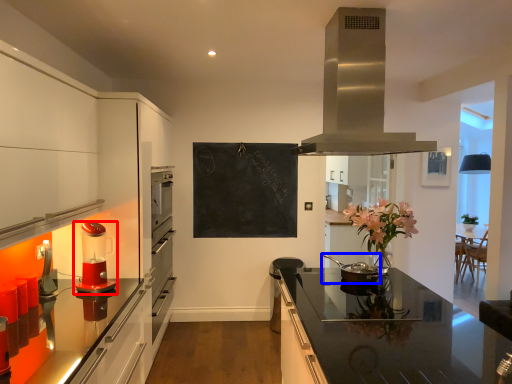
Question: Which point is further to the camera, kitchen appliance (highlighted by a red box) or kitchen appliance (highlighted by a blue box)?

Choices:
 (A) kitchen appliance
 (B) kitchen appliance

Answer: (B)